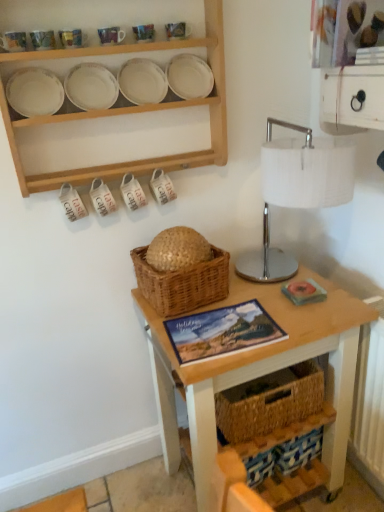
Question: Is matte ceramic mug at upper center, placed as the fourth tableware when sorted from left to right, taller or shorter than matte ceramic mug at upper left, the first tableware from the left?

Choices:
 (A) short
 (B) tall

Answer: (B)

Question: In terms of width, does matte ceramic mug at upper center, placed as the fourth tableware when sorted from left to right, look wider or thinner when compared to matte ceramic mug at upper left, the 5th tableware from the right?

Choices:
 (A) wide
 (B) thin

Answer: (B)

Question: Which object is positioned farthest from the matte paper book at center?

Choices:
 (A) matte ceramic mug at upper center, which appears as the first tableware when viewed from the right
 (B) woven straw basket at center
 (C) matte ceramic mug at upper left, the 5th tableware from the right
 (D) white fabric-covered lamp at upper right
 (E) natural wood plates at upper center

Answer: (C)

Question: Which of these objects is positioned closest to the wooden table at center?

Choices:
 (A) white fabric-covered lamp at upper right
 (B) matte ceramic mug at upper center, the third tableware in the right-to-left sequence
 (C) matte ceramic mug at upper center, placed as the fourth tableware when sorted from left to right
 (D) matte ceramic mug at upper left, marked as the fourth tableware in a right-to-left arrangement
 (E) natural wood plates at upper center

Answer: (A)